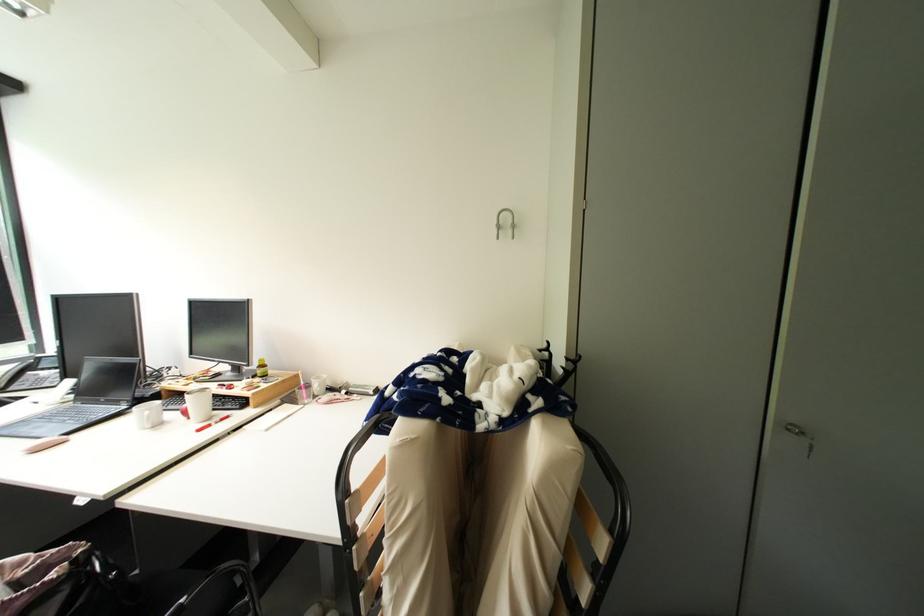
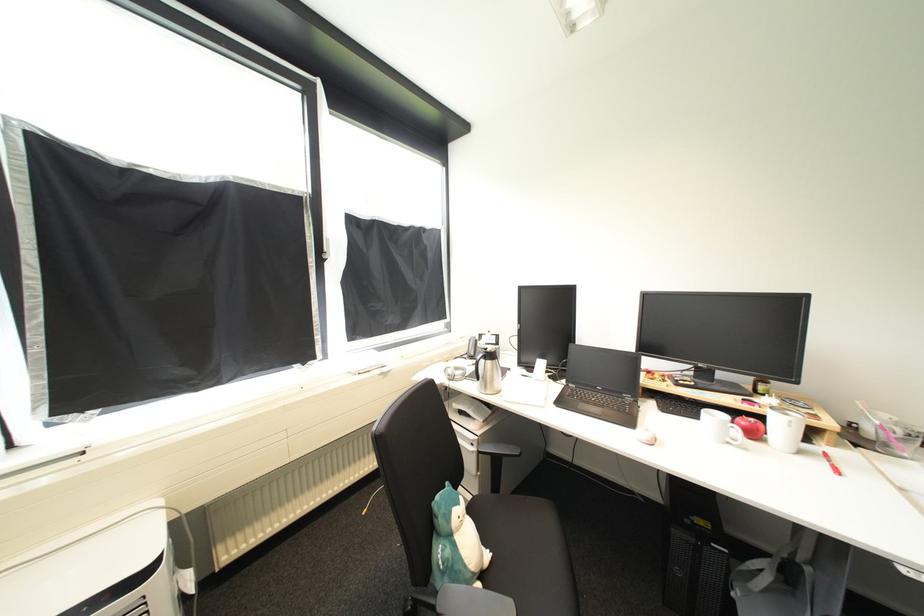
Locate, in the second image, the point that corresponds to pixel 159 429 in the first image.

(736, 445)